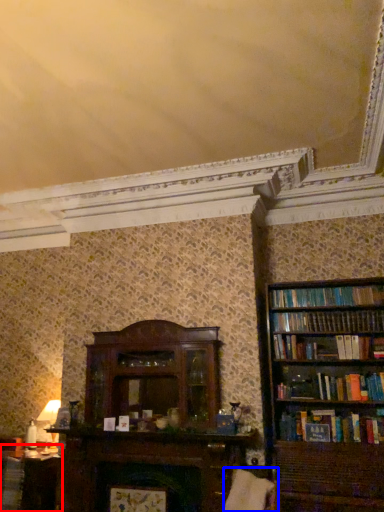
Question: Among these objects, which one is farthest to the camera, table (highlighted by a red box) or swivel chair (highlighted by a blue box)?

Choices:
 (A) table
 (B) swivel chair

Answer: (A)